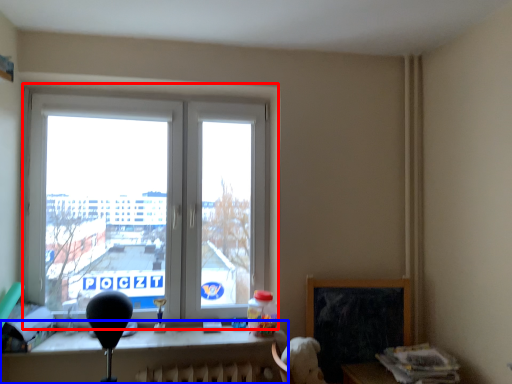
Question: Which object appears closest to the camera in this image, window (highlighted by a red box) or table (highlighted by a blue box)?

Choices:
 (A) window
 (B) table

Answer: (B)